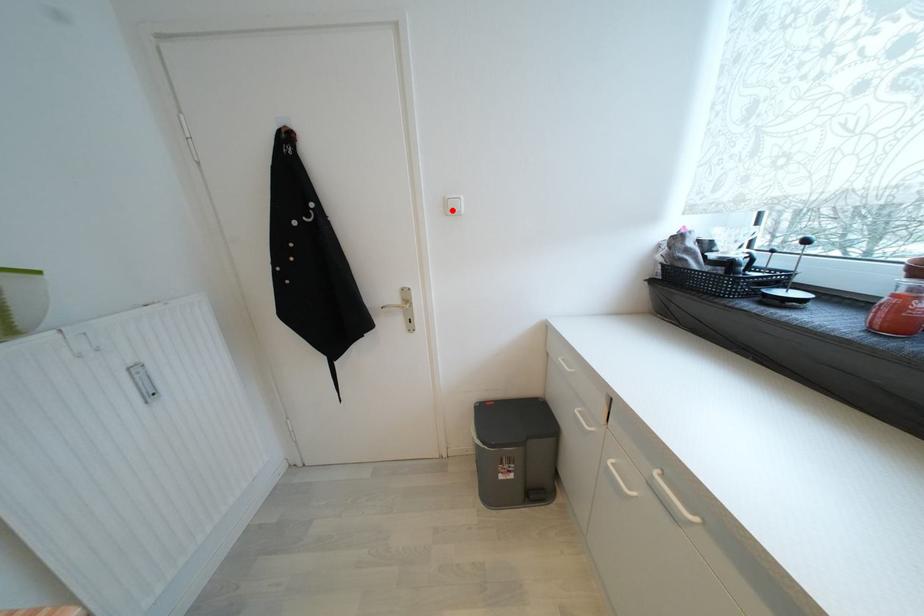
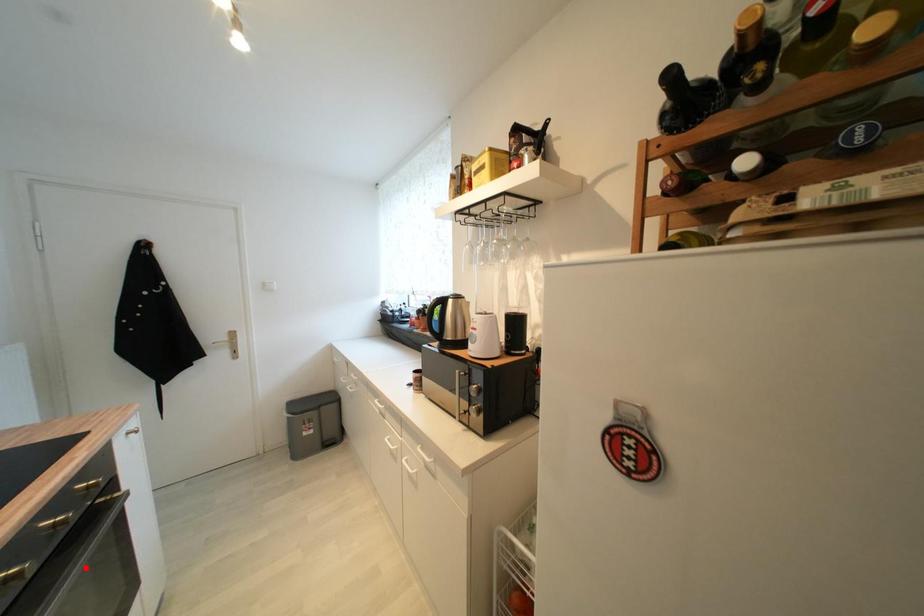
I am providing you with two images of the same scene from different viewpoints. A red point is marked on the first image and another point is marked on the second image. Does the point marked in image1 correspond to the same location as the one in image2?

No